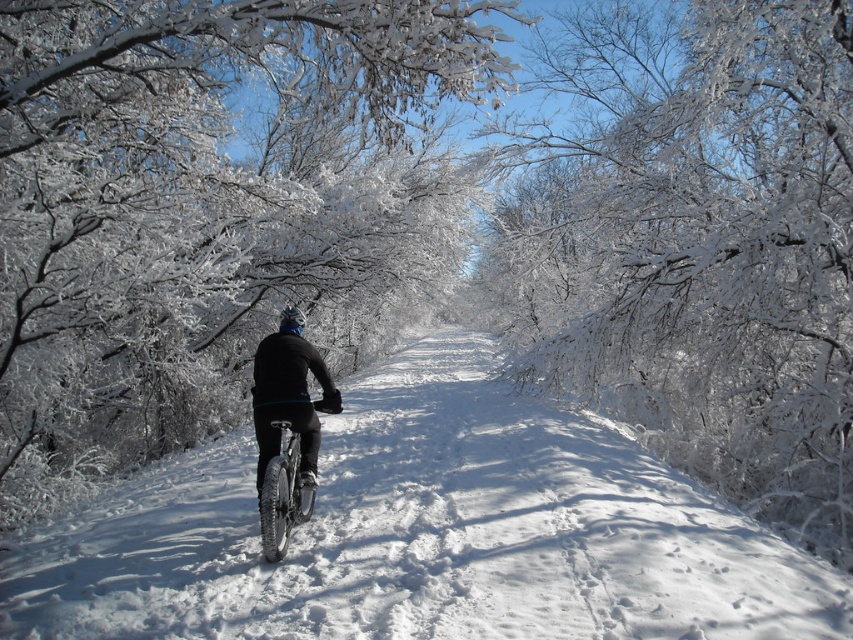
Between white fluffy snow at center and silver metallic bicycle at center, which one has less height?

white fluffy snow at center

Which is below, white fluffy snow at center or silver metallic bicycle at center?

Positioned lower is white fluffy snow at center.

Is point (320, 582) less distant than point (294, 468)?

Yes, it is in front of point (294, 468).

This screenshot has width=853, height=640. Identify the location of white fluffy snow at center. (425, 534).

Who is lower down, snow-covered branches at center or white fluffy snow at center?

white fluffy snow at center is below.

Is snow-covered branches at center in front of white fluffy snow at center?

No, snow-covered branches at center is behind white fluffy snow at center.

Image resolution: width=853 pixels, height=640 pixels. In order to click on snow-covered branches at center in this screenshot , I will do `click(202, 195)`.

Who is more forward, (793, 468) or (293, 476)?

Point (293, 476) is in front.

I want to click on white frosty branches at center, so click(703, 241).